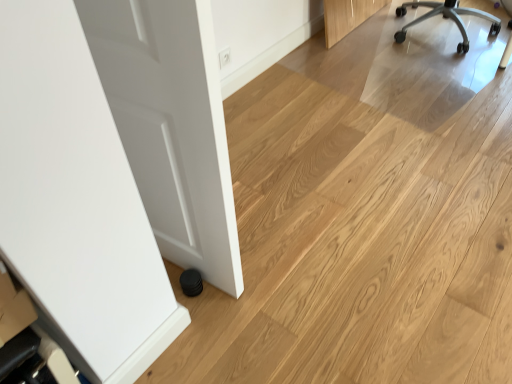
The height and width of the screenshot is (384, 512). In order to click on free space that is in between white glossy door at left and silver metallic chair at upper right in this screenshot , I will do `click(347, 119)`.